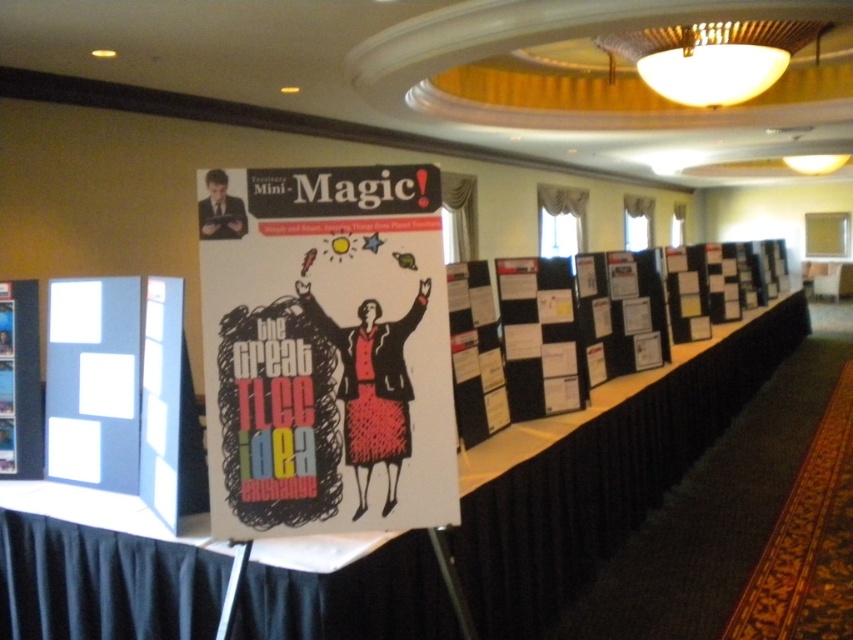
Question: Is matte black poster at center in front of white cardboard poster at left?

Choices:
 (A) no
 (B) yes

Answer: (B)

Question: Is matte black poster at center to the left of white cardboard poster at left from the viewer's perspective?

Choices:
 (A) no
 (B) yes

Answer: (A)

Question: Can you confirm if matte black poster at center is positioned to the right of white cardboard poster at left?

Choices:
 (A) no
 (B) yes

Answer: (B)

Question: Which object appears farthest from the camera in this image?

Choices:
 (A) matte black poster at center
 (B) white cardboard poster at left

Answer: (B)

Question: Which point is closer to the camera?

Choices:
 (A) (347, 401)
 (B) (10, 403)

Answer: (A)